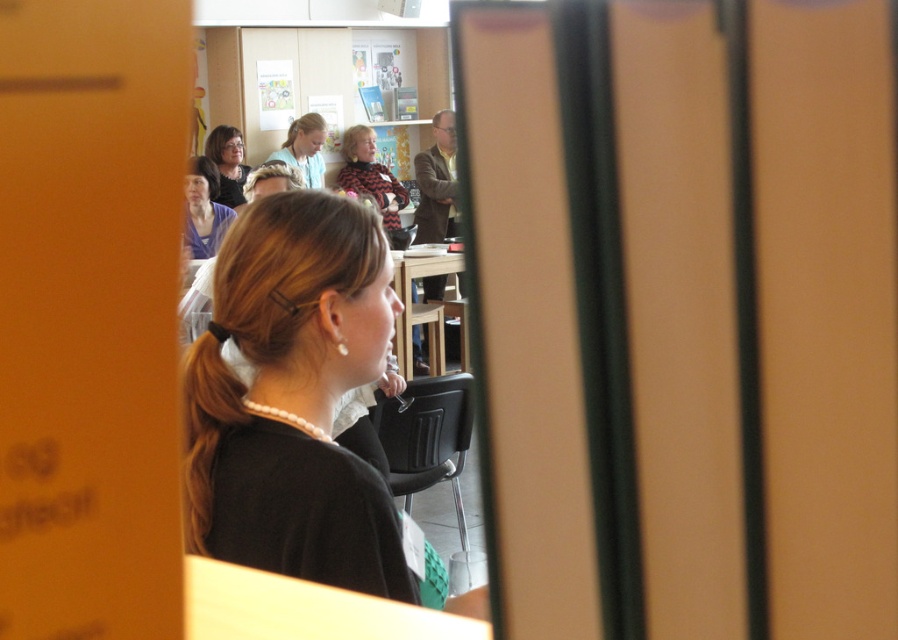
Who is more forward, (350, 161) or (297, 145)?

Point (297, 145) is more forward.

Can you confirm if black textured sweater at center is thinner than matte blue shirt at upper center?

No, black textured sweater at center is not thinner than matte blue shirt at upper center.

Is point (386, 180) positioned before point (321, 161)?

No, (386, 180) is behind (321, 161).

The height and width of the screenshot is (640, 898). In order to click on black textured sweater at center in this screenshot , I will do `click(370, 176)`.

Is wooden at center positioned in front of matte black sweater at upper left?

Yes, it is in front of matte black sweater at upper left.

What are the coordinates of `wooden at center` in the screenshot? It's located at [x=420, y=308].

Is point (227, 378) closer to camera compared to point (219, 141)?

Yes, it is in front of point (219, 141).

Between blonde hair at center and matte black sweater at upper left, which one has less height?

Standing shorter between the two is blonde hair at center.

Find the location of a particular element. This screenshot has height=640, width=898. blonde hair at center is located at coordinates (207, 422).